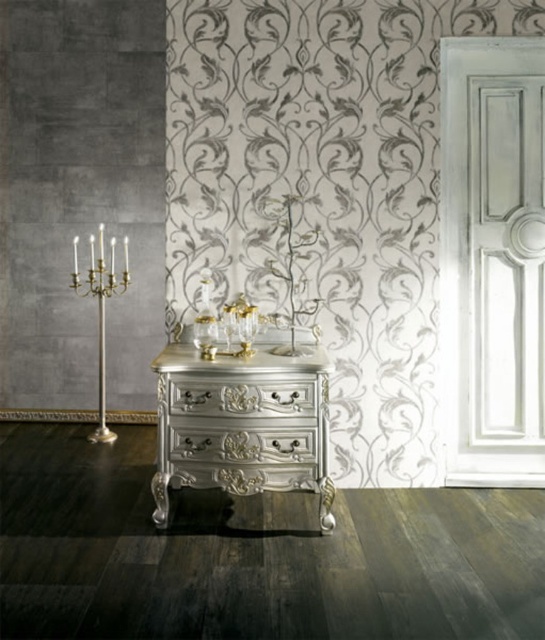
Question: Is silver polished drawer at center below gold polished brass candle holder at left?

Choices:
 (A) yes
 (B) no

Answer: (A)

Question: Which object is positioned closest to the silver polished drawer at center?

Choices:
 (A) gold polished brass candle holder at left
 (B) silver polished wood drawer at center

Answer: (B)

Question: Among these objects, which one is farthest from the camera?

Choices:
 (A) silver polished wood drawer at center
 (B) gold polished brass candle holder at left
 (C) silver polished wood vanity at center

Answer: (B)

Question: Does silver polished wood vanity at center have a lesser width compared to silver polished drawer at center?

Choices:
 (A) yes
 (B) no

Answer: (B)

Question: Which object appears closest to the camera in this image?

Choices:
 (A) silver polished drawer at center
 (B) silver polished wood vanity at center
 (C) gold polished brass candle holder at left

Answer: (B)

Question: Is silver polished wood vanity at center positioned behind gold polished brass candle holder at left?

Choices:
 (A) yes
 (B) no

Answer: (B)